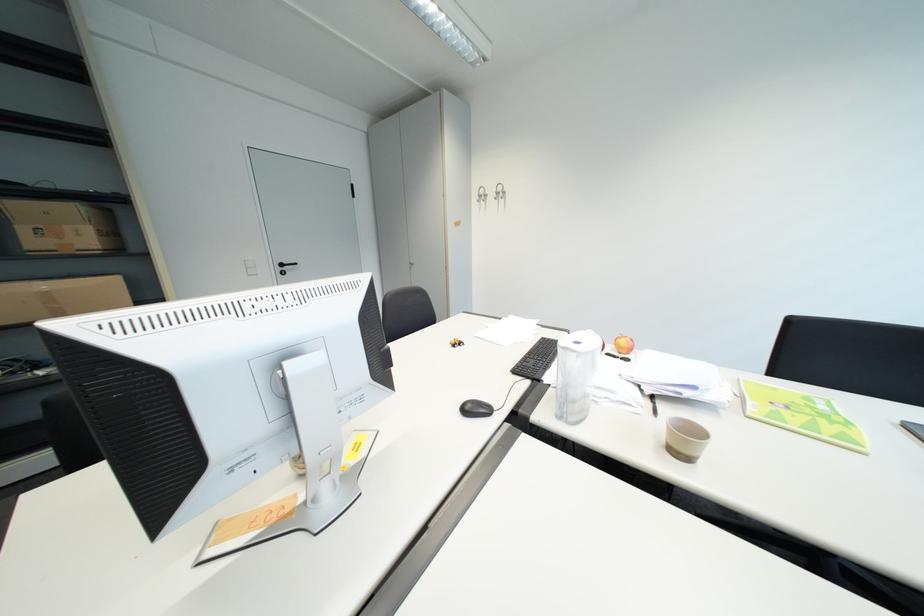
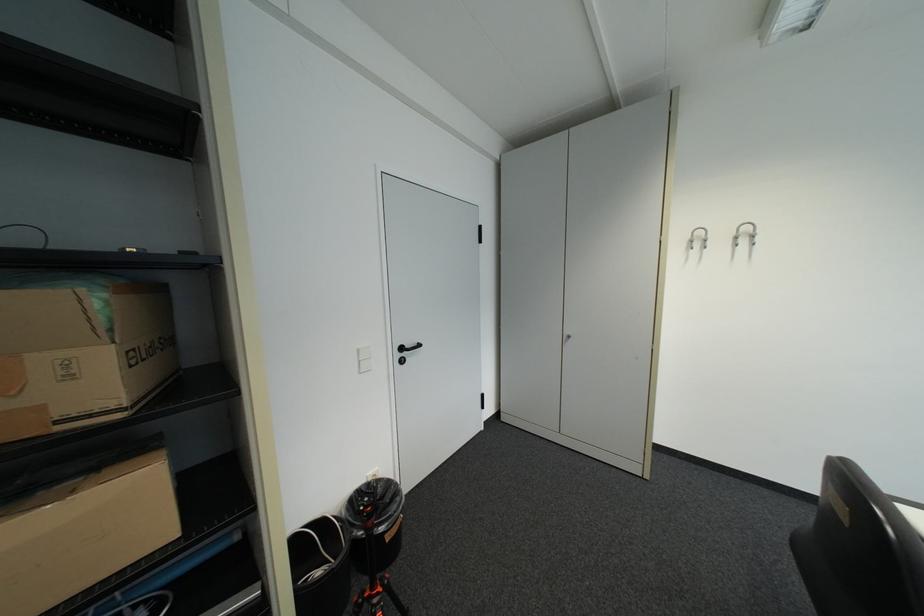
Which direction would the cameraman need to move to produce the second image?

The cameraman moved toward left, forward.